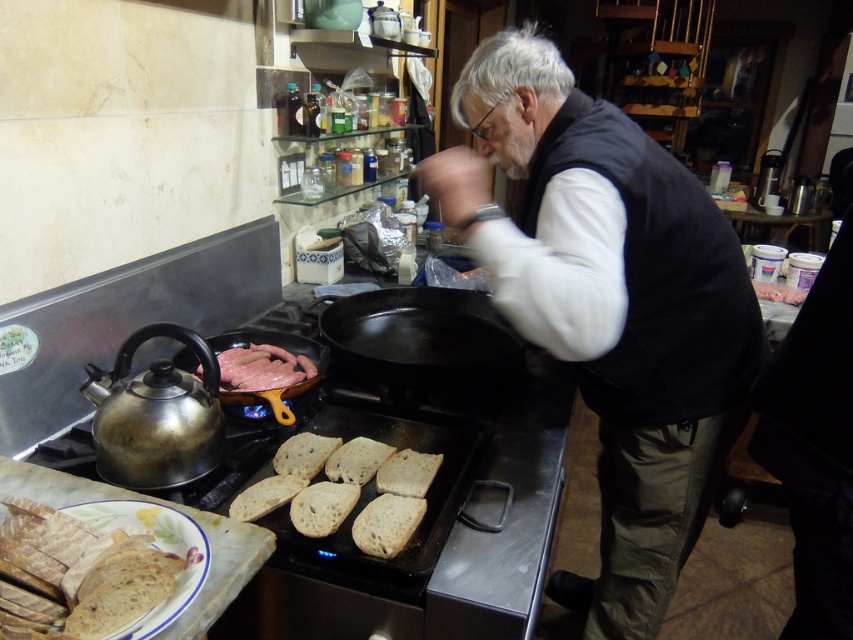
You are standing in the kitchen and want to reach both the point at coordinates [215,458] and the point at coordinates [379,545]. Which point is closer to you?

The point at coordinates [215,458] is closer to you because it is further to the viewer than the point at coordinates [379,545].

You are a kitchen assistant and need to grab the shiny metallic kettle at left to pour hot water. However, there is a brown crusty bread at lower left nearby. Which object is closer to the edge of the counter to avoid knocking over?

The shiny metallic kettle at left is to the left of brown crusty bread at lower left, so it is closer to the edge of the counter. To avoid knocking over, you should grab the shiny metallic kettle at left first.